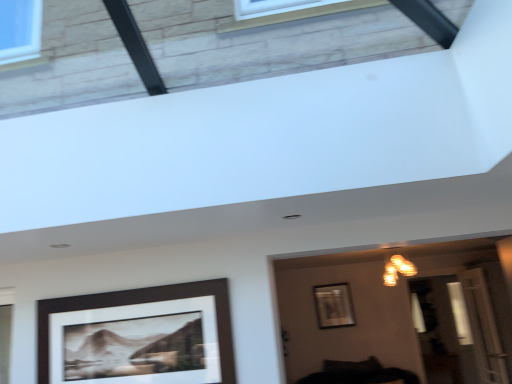
Question: Is warm matte light fixture at upper center far from metallic silver picture frame at center, placed as the first picture frame when sorted from back to front?

Choices:
 (A) yes
 (B) no

Answer: (B)

Question: From the image's perspective, does warm matte light fixture at upper center appear lower than metallic silver picture frame at center, placed as the first picture frame when sorted from back to front?

Choices:
 (A) no
 (B) yes

Answer: (A)

Question: From a real-world perspective, is warm matte light fixture at upper center under metallic silver picture frame at center, which is the 1th picture frame in bottom-to-top order?

Choices:
 (A) no
 (B) yes

Answer: (A)

Question: Could you tell me if warm matte light fixture at upper center is turned towards metallic silver picture frame at center, the first picture frame from the right?

Choices:
 (A) yes
 (B) no

Answer: (B)

Question: Is the position of warm matte light fixture at upper center more distant than that of metallic silver picture frame at center, which is the 1th picture frame in bottom-to-top order?

Choices:
 (A) no
 (B) yes

Answer: (A)

Question: Is transparent glass door at lower right wider or thinner than black matte picture frame at lower left, the 2th picture frame from the back?

Choices:
 (A) wide
 (B) thin

Answer: (A)

Question: From the image's perspective, relative to black matte picture frame at lower left, the 1th picture frame positioned from the top, is transparent glass door at lower right above or below?

Choices:
 (A) above
 (B) below

Answer: (B)

Question: Is point (465, 286) closer or farther from the camera than point (123, 304)?

Choices:
 (A) farther
 (B) closer

Answer: (A)

Question: Relative to black matte picture frame at lower left, placed as the second picture frame when sorted from bottom to top, is transparent glass door at lower right in front or behind?

Choices:
 (A) behind
 (B) front

Answer: (A)

Question: Relative to warm matte light fixture at upper center, is metallic silver picture frame at center, placed as the second picture frame when sorted from top to bottom, in front or behind?

Choices:
 (A) behind
 (B) front

Answer: (A)

Question: In the image, is metallic silver picture frame at center, placed as the second picture frame when sorted from top to bottom, on the left side or the right side of warm matte light fixture at upper center?

Choices:
 (A) left
 (B) right

Answer: (A)

Question: Considering the positions of metallic silver picture frame at center, which is the 1th picture frame in bottom-to-top order, and warm matte light fixture at upper center in the image, is metallic silver picture frame at center, which is the 1th picture frame in bottom-to-top order, wider or thinner than warm matte light fixture at upper center?

Choices:
 (A) thin
 (B) wide

Answer: (A)

Question: Is metallic silver picture frame at center, which appears as the 2th picture frame when viewed from the front, spatially inside warm matte light fixture at upper center, or outside of it?

Choices:
 (A) outside
 (B) inside

Answer: (A)

Question: Is black matte picture frame at lower left, acting as the first picture frame starting from the front, in front of or behind transparent glass door at lower right in the image?

Choices:
 (A) behind
 (B) front

Answer: (B)

Question: Visually, is black matte picture frame at lower left, placed as the first picture frame when sorted from left to right, positioned to the left or to the right of transparent glass door at lower right?

Choices:
 (A) right
 (B) left

Answer: (B)